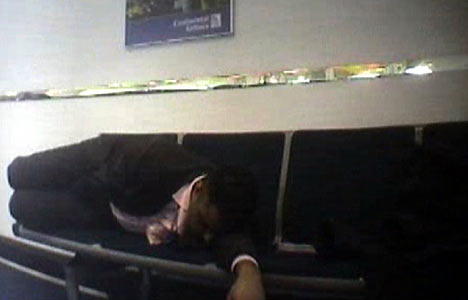
The width and height of the screenshot is (468, 300). Identify the location of grey wall. (230, 115).